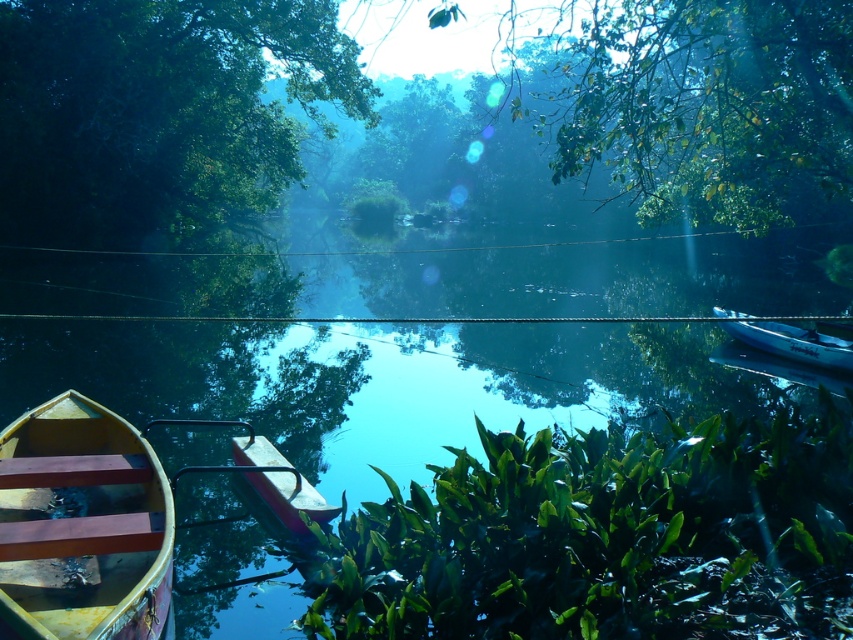
Which of these two, transparent glass river at center or wooden canoe at center, stands taller?

With more height is transparent glass river at center.

Is transparent glass river at center closer to camera compared to wooden canoe at center?

Yes, transparent glass river at center is in front of wooden canoe at center.

The height and width of the screenshot is (640, 853). What are the coordinates of `transparent glass river at center` in the screenshot? It's located at 416,333.

You are a GUI agent. You are given a task and a screenshot of the screen. Output one action in this format:
    pyautogui.click(x=<x>, y=<y>)
    Task: Click on the transparent glass river at center
    
    Given the screenshot: What is the action you would take?
    pyautogui.click(x=416, y=333)

Does transparent glass river at center have a lesser width compared to green leafy plant at center?

In fact, transparent glass river at center might be wider than green leafy plant at center.

Is transparent glass river at center closer to camera compared to green leafy plant at center?

No.

Locate an element on the screen. transparent glass river at center is located at coordinates (416, 333).

Which of these two, green leafy plant at center or green leafy tree at upper left, stands taller?

With more height is green leafy tree at upper left.

Consider the image. Is green leafy plant at center bigger than green leafy tree at upper left?

Incorrect, green leafy plant at center is not larger than green leafy tree at upper left.

Is point (540, 582) farther from viewer compared to point (155, 58)?

That is False.

Where is `green leafy plant at center`? The image size is (853, 640). green leafy plant at center is located at coordinates (606, 538).